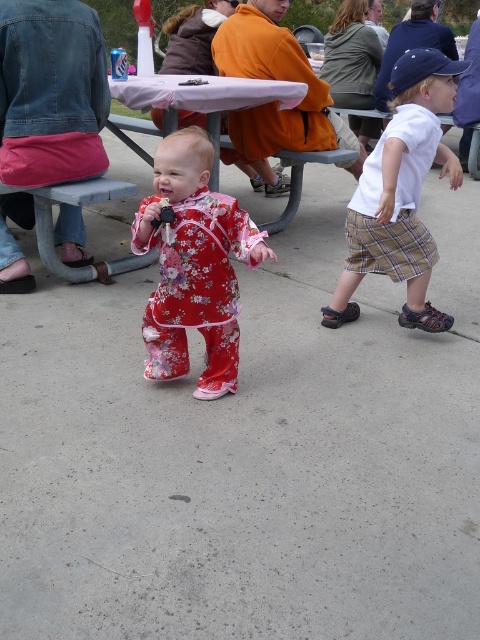
You are a photographer trying to capture a clear shot of the floral cotton outfit at center and the white plastic picnic table at center. Which object should you focus on first to ensure both are in focus?

The floral cotton outfit at center is in front of the white plastic picnic table at center, so you should focus on the floral cotton outfit at center first to ensure both are in focus.

You are a photographer trying to capture the perfect shot of the floral cotton outfit at center. Given its position at coordinates, what is the best camera angle to ensure it is centered in your frame?

The floral cotton outfit at center is already positioned at coordinates, so centering the camera directly on those coordinates would ensure it is centered in the frame.

You are a parent trying to keep your child safe at the park. Your child is wearing a white cotton shirt at right and you are standing next to the white plastic picnic table at center. Can you easily reach out and hold their hand without moving from your current position?

The distance between the white cotton shirt at right and the white plastic picnic table at center is 1.54 meters. Since this distance is relatively short, you can likely reach out and hold their hand without needing to move from your current position.